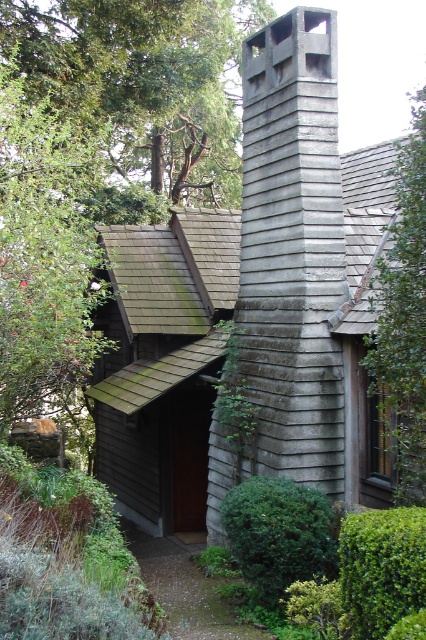
The image size is (426, 640). Find the location of `green leafy tree at upper left`. green leafy tree at upper left is located at coordinates pos(143,81).

Does green leafy tree at upper left have a larger size compared to green leafy tree at right?

No, green leafy tree at upper left is not bigger than green leafy tree at right.

Between point (31, 54) and point (425, 355), which one is positioned in front?

Point (425, 355) is in front.

The image size is (426, 640). In order to click on green leafy tree at upper left in this screenshot , I will do `click(143, 81)`.

Does gray wood chimney at center have a lesser width compared to green leafy tree at upper left?

Yes, gray wood chimney at center is thinner than green leafy tree at upper left.

Consider the image. Who is more forward, (282, 280) or (176, 116)?

Positioned in front is point (282, 280).

At what (x,y) coordinates should I click in order to perform the action: click on gray wood chimney at center. Please return your answer as a coordinate pair (x, y). The height and width of the screenshot is (640, 426). Looking at the image, I should click on (293, 248).

Can you confirm if wooden cabin at center is bigger than gray wood chimney at center?

Yes, wooden cabin at center is bigger than gray wood chimney at center.

Can you confirm if wooden cabin at center is smaller than gray wood chimney at center?

Incorrect, wooden cabin at center is not smaller in size than gray wood chimney at center.

Does point (155, 456) come behind point (241, 76)?

That is False.

Find the location of a particular element. This screenshot has width=426, height=640. wooden cabin at center is located at coordinates (164, 362).